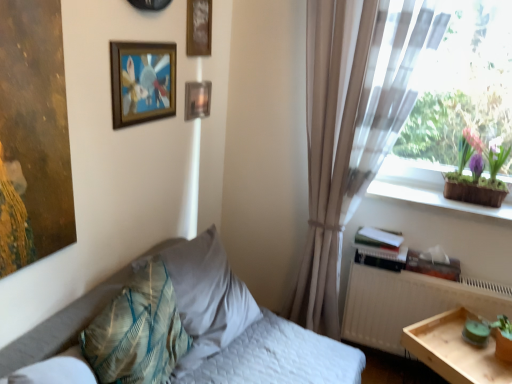
Question: Considering the relative sizes of translucent fabric at upper right and white matte radiator at right in the image provided, is translucent fabric at upper right smaller than white matte radiator at right?

Choices:
 (A) yes
 (B) no

Answer: (B)

Question: Is translucent fabric at upper right not near white matte radiator at right?

Choices:
 (A) no
 (B) yes

Answer: (B)

Question: Considering the relative sizes of translucent fabric at upper right and white matte radiator at right in the image provided, is translucent fabric at upper right wider than white matte radiator at right?

Choices:
 (A) no
 (B) yes

Answer: (B)

Question: From a real-world perspective, is translucent fabric at upper right beneath white matte radiator at right?

Choices:
 (A) no
 (B) yes

Answer: (A)

Question: Can you confirm if translucent fabric at upper right is shorter than white matte radiator at right?

Choices:
 (A) no
 (B) yes

Answer: (A)

Question: Is translucent fabric at upper right positioned beyond the bounds of white matte radiator at right?

Choices:
 (A) no
 (B) yes

Answer: (B)

Question: Is textured teal pillow at lower left, positioned as the 1th pillow in front-to-back order, oriented away from translucent fabric at upper right?

Choices:
 (A) no
 (B) yes

Answer: (A)

Question: Is textured teal pillow at lower left, the 2th pillow in the back-to-front sequence, closer to the viewer compared to translucent fabric at upper right?

Choices:
 (A) no
 (B) yes

Answer: (B)

Question: Is textured teal pillow at lower left, positioned as the 1th pillow in front-to-back order, completely or partially outside of translucent fabric at upper right?

Choices:
 (A) yes
 (B) no

Answer: (A)

Question: From a real-world perspective, is textured teal pillow at lower left, positioned as the 1th pillow in front-to-back order, located higher than translucent fabric at upper right?

Choices:
 (A) yes
 (B) no

Answer: (B)

Question: Is translucent fabric at upper right a part of textured teal pillow at lower left, the 2th pillow in the back-to-front sequence?

Choices:
 (A) yes
 (B) no

Answer: (B)

Question: Does textured teal pillow at lower left, positioned as the 1th pillow in front-to-back order, appear on the left side of translucent fabric at upper right?

Choices:
 (A) no
 (B) yes

Answer: (B)

Question: Does light wood tray at lower right have a lesser height compared to white quilted bed at lower left?

Choices:
 (A) yes
 (B) no

Answer: (A)